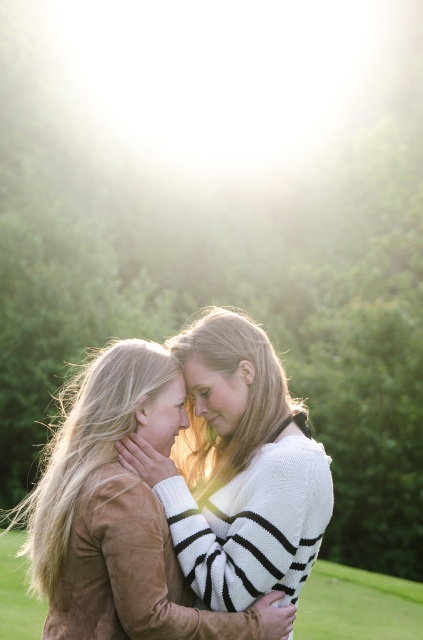
Question: Is suede brown jacket at center below suede jacket at center?

Choices:
 (A) yes
 (B) no

Answer: (A)

Question: Can you confirm if suede brown jacket at center is smaller than suede jacket at center?

Choices:
 (A) no
 (B) yes

Answer: (A)

Question: Which object is positioned closest to the suede brown jacket at center?

Choices:
 (A) green grass at lower right
 (B) suede jacket at center

Answer: (B)

Question: Considering the real-world distances, which object is closest to the suede brown jacket at center?

Choices:
 (A) green grass at lower right
 (B) suede jacket at center

Answer: (B)

Question: Considering the relative positions of suede brown jacket at center and green grass at lower right in the image provided, where is suede brown jacket at center located with respect to green grass at lower right?

Choices:
 (A) right
 (B) left

Answer: (B)

Question: Among these points, which one is nearest to the camera?

Choices:
 (A) (121, 637)
 (B) (359, 589)
 (C) (43, 566)

Answer: (A)